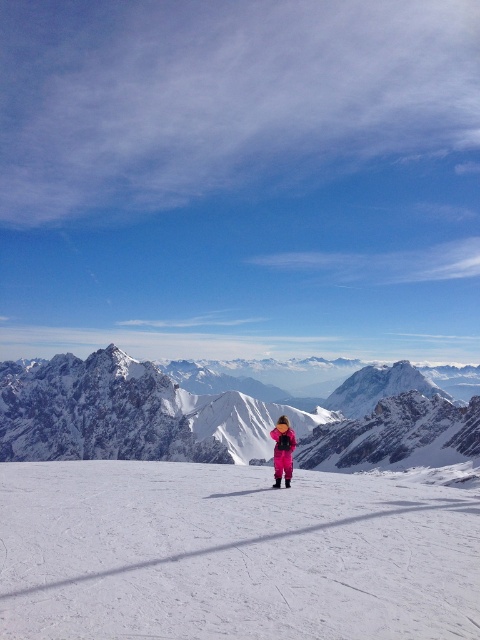
Question: Is the position of pink fabric ski slope at center more distant than that of pink snowsuit at center?

Choices:
 (A) yes
 (B) no

Answer: (B)

Question: Which point appears closest to the camera in this image?

Choices:
 (A) (97, 483)
 (B) (415, 456)
 (C) (285, 483)

Answer: (A)

Question: Estimate the real-world distances between objects in this image. Which object is closer to the pink snowsuit at center?

Choices:
 (A) pink fabric ski at center
 (B) pink fabric ski slope at center
 (C) snowy rocky mountain at center

Answer: (A)

Question: From the image, what is the correct spatial relationship of pink fabric ski slope at center in relation to snowy rocky mountain at center?

Choices:
 (A) below
 (B) above

Answer: (B)

Question: Is pink fabric ski slope at center in front of pink snowsuit at center?

Choices:
 (A) no
 (B) yes

Answer: (B)

Question: Which of the following is the closest to the observer?

Choices:
 (A) pink snowsuit at center
 (B) pink fabric ski slope at center
 (C) snowy rocky mountain at center
 (D) pink fabric ski at center

Answer: (B)